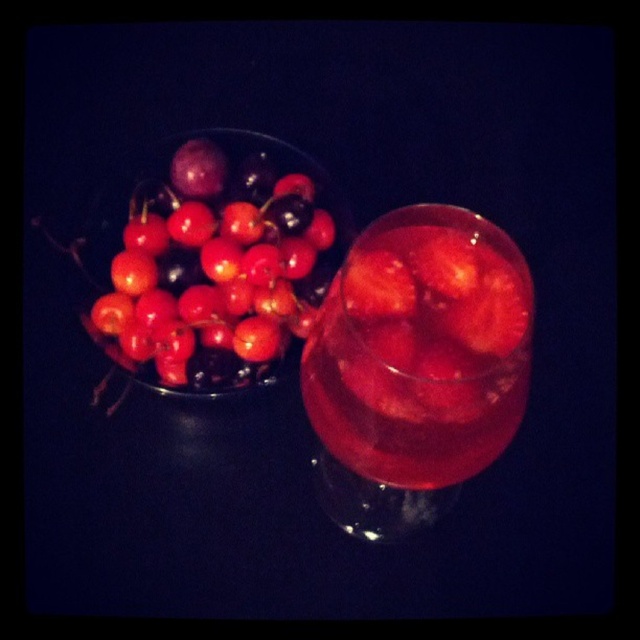
In the scene shown: You are a bartender preparing a drink. You have a translucent glass at center and shiny red cherries at upper left. Which object has a smaller width?

The translucent glass at center has a lesser width compared to shiny red cherries at upper left.

You are standing in front of the image and want to pour the liquid from the translucent glass at center into a container behind the shiny red cherries at upper left. Is this possible without moving the cherries?

The translucent glass at center is in front of the shiny red cherries at upper left, so pouring the liquid from the translucent glass at center into a container behind the shiny red cherries at upper left would require moving the glass, which is in front of the cherries. Therefore, it is not possible to pour the liquid without moving the shiny red cherries at upper left.

You are a bartender preparing a drink and need to place a garnish at the exact center of the glass. Given that the glass is located at point (417, 365), where should you place the garnish?

The garnish should be placed at the center of the translucent glass at point (417, 365).